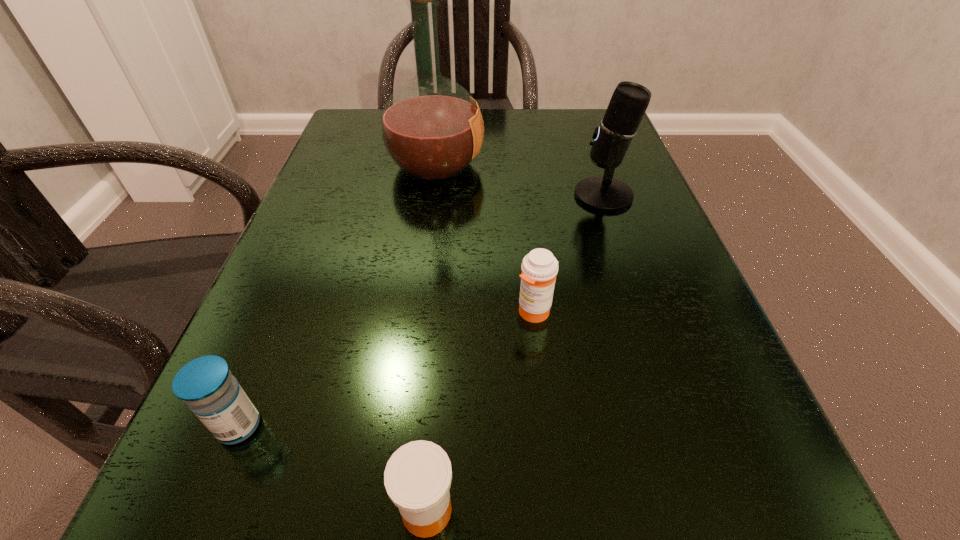
Where is `liquor`? The image size is (960, 540). liquor is located at coordinates (432, 128).

Where is `microphone`? microphone is located at coordinates (628, 104).

This screenshot has width=960, height=540. What are the coordinates of `the rightmost object` in the screenshot? It's located at (628, 104).

Where is `the rightmost medicine`? This screenshot has width=960, height=540. the rightmost medicine is located at coordinates (539, 268).

This screenshot has width=960, height=540. In order to click on the second object from right to left in this screenshot , I will do `click(539, 268)`.

Identify the location of the leftmost medicine. The image size is (960, 540). (206, 384).

Where is `the leftmost object`? The image size is (960, 540). the leftmost object is located at coordinates (206, 384).

At what (x,y) coordinates should I click in order to perform the action: click on vacant space located 0.270m on the front label of the tallest object. Please return your answer as a coordinate pair (x, y). Image resolution: width=960 pixels, height=540 pixels. Looking at the image, I should click on (614, 164).

This screenshot has height=540, width=960. Find the location of `vacant space located on the left of the rightmost object`. vacant space located on the left of the rightmost object is located at coordinates point(421,195).

Locate an element on the screen. free space located 0.200m on the back of the farthest medicine is located at coordinates (522, 215).